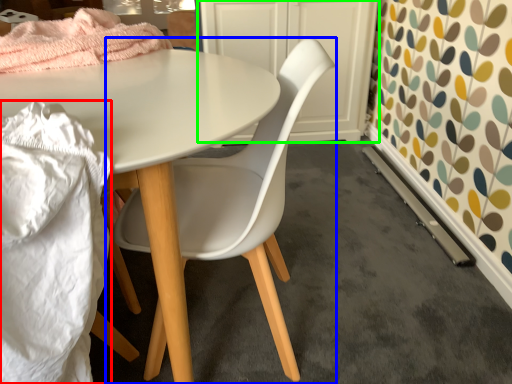
Question: Estimate the real-world distances between objects in this image. Which object is closer to material (highlighted by a red box), chair (highlighted by a blue box) or cabinetry (highlighted by a green box)?

Choices:
 (A) chair
 (B) cabinetry

Answer: (A)